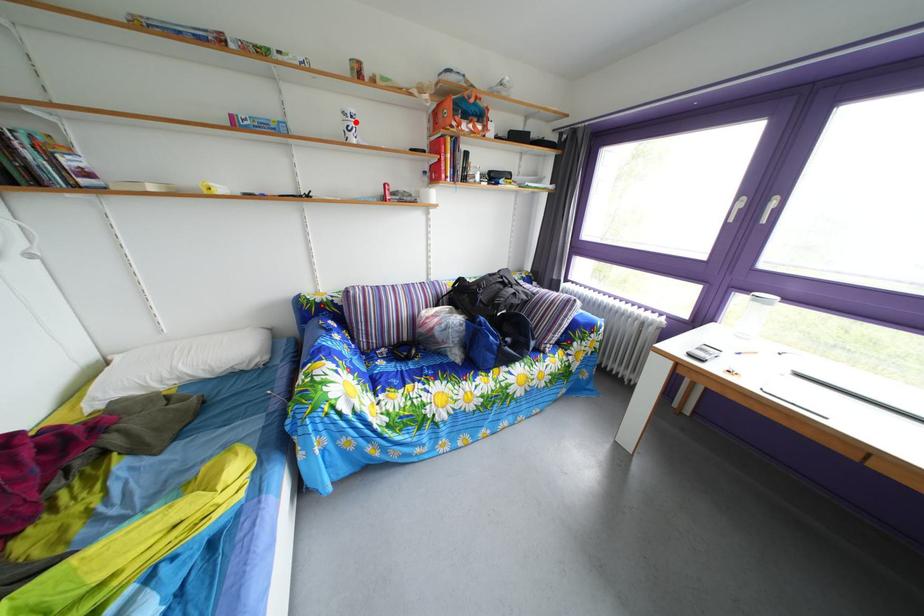
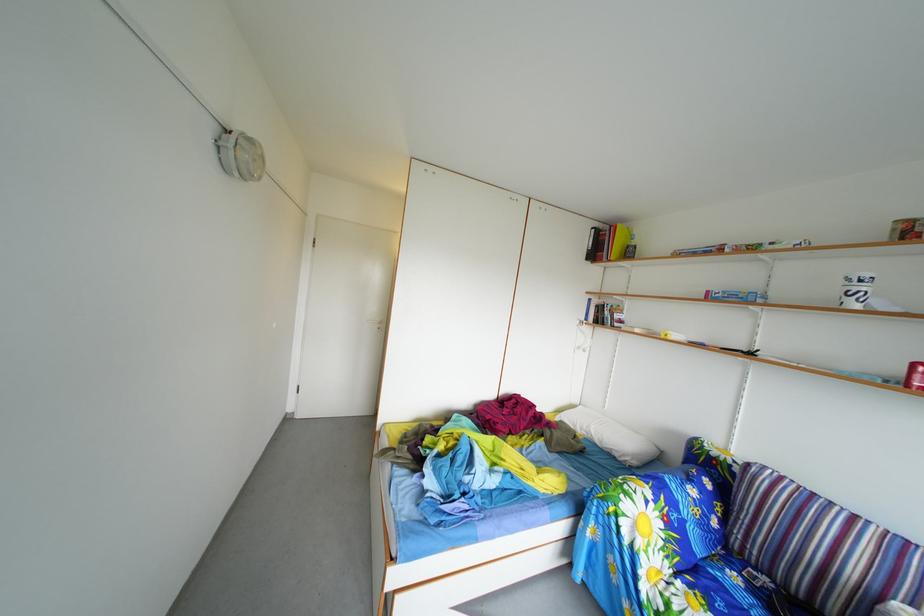
Question: I am providing you with two images of the same scene from different viewpoints. A red point is shown in image1. For the corresponding object point in image2, is it positioned nearer or farther from the camera?

Choices:
 (A) Nearer
 (B) Farther

Answer: (B)